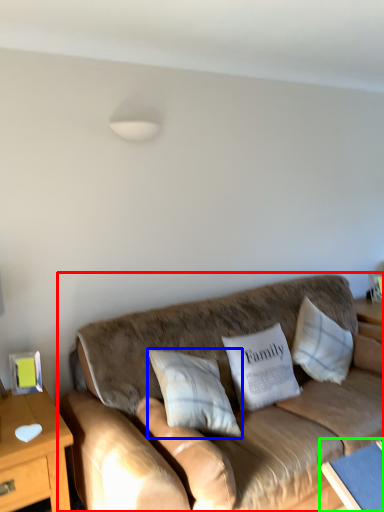
Question: Estimate the real-world distances between objects in this image. Which object is closer to studio couch (highlighted by a red box), pillow (highlighted by a blue box) or table (highlighted by a green box)?

Choices:
 (A) pillow
 (B) table

Answer: (A)